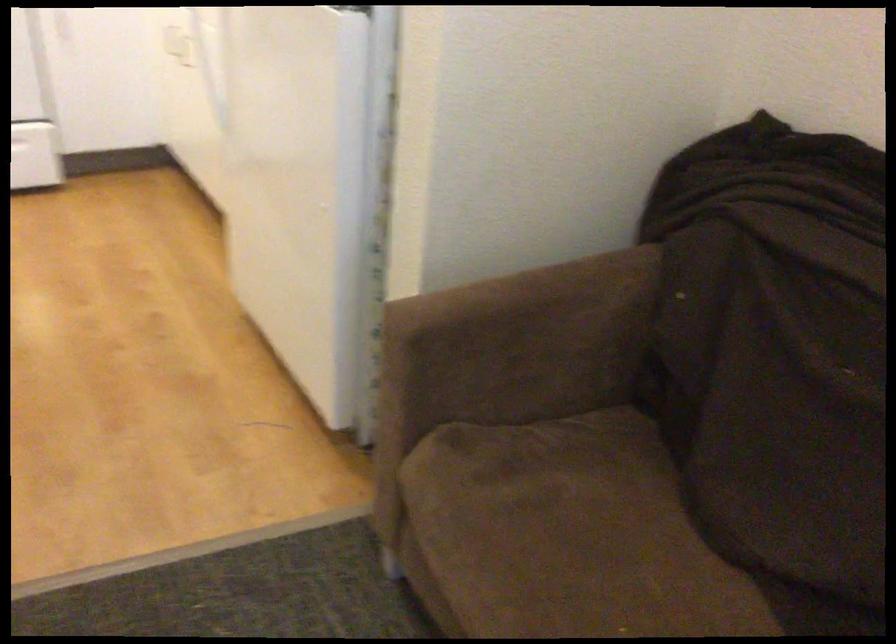
Where would you sit the sofa sitting surface? Please return your answer as a coordinate pair (x, y).

(563, 542)